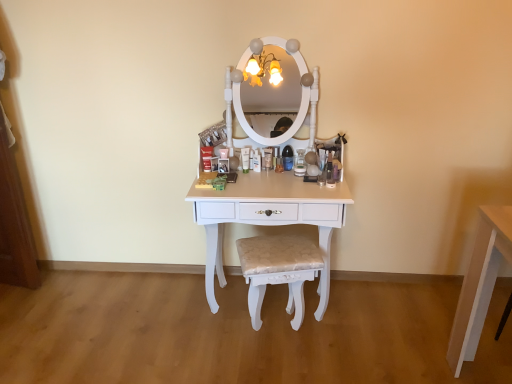
I want to click on vacant space in front of matte white tube at center, so click(248, 181).